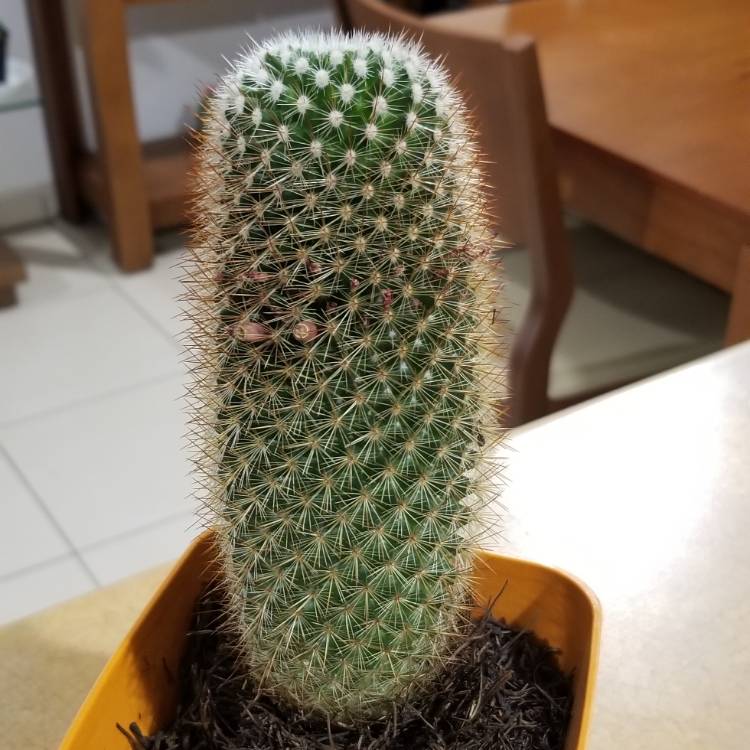
This screenshot has height=750, width=750. Find the location of `seat`. seat is located at coordinates (616, 307).